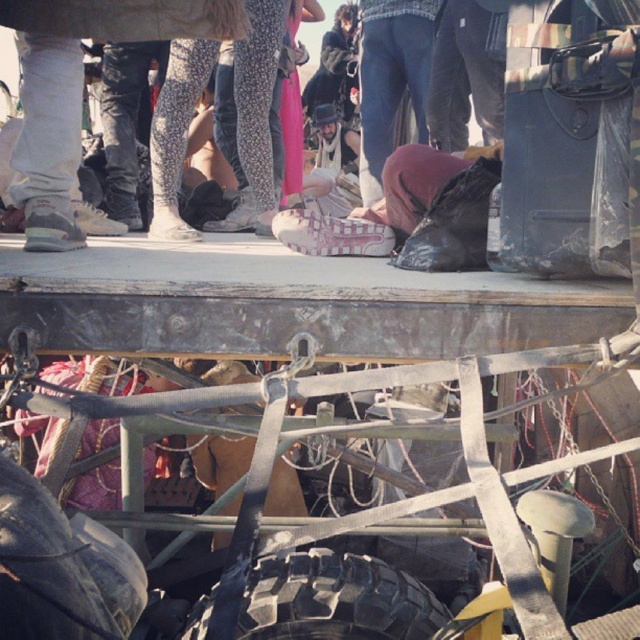
Is black rubber tire at lower left positioned in front of black rubber tire at bottom?

Yes, it is.

Which is in front, point (38, 545) or point (259, 593)?

Point (38, 545) is in front.

The image size is (640, 640). What are the coordinates of `black rubber tire at lower left` in the screenshot? It's located at (60, 568).